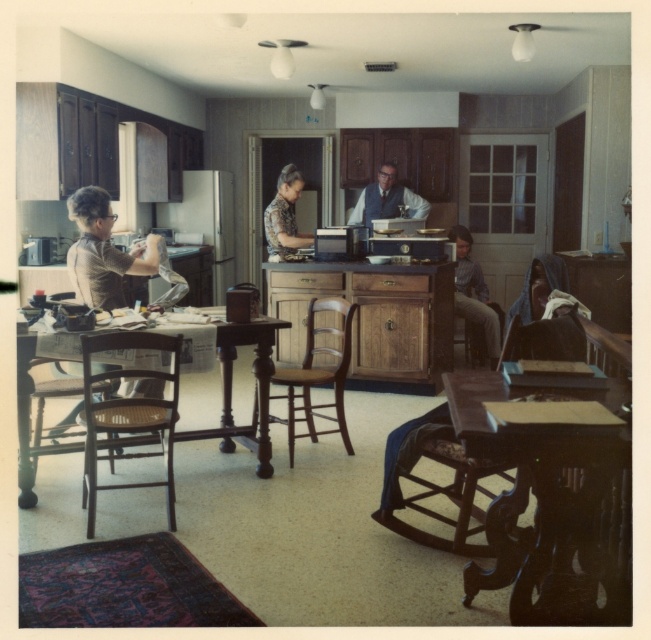
Question: Is woven wood chair at lower left further to camera compared to woven wood chair at lower right?

Choices:
 (A) no
 (B) yes

Answer: (A)

Question: Estimate the real-world distances between objects in this image. Which object is farther from the floral shirt at center?

Choices:
 (A) woven cane chair at left
 (B) brown wooden table at left
 (C) matte black vest at center

Answer: (A)

Question: Which is nearer to the dark wood table at lower right?

Choices:
 (A) woven wood chair at lower right
 (B) floral shirt at center
 (C) woven cane chair at left

Answer: (C)

Question: Does brown wooden table at left have a greater width compared to wooden chair at center?

Choices:
 (A) no
 (B) yes

Answer: (A)

Question: Considering the relative positions of woven cane chair at left and woven wood chair at lower left in the image provided, where is woven cane chair at left located with respect to woven wood chair at lower left?

Choices:
 (A) above
 (B) below

Answer: (B)

Question: Among these points, which one is farthest from the camera?

Choices:
 (A) (482, 362)
 (B) (283, 321)
 (C) (270, 202)
 (D) (339, 374)

Answer: (C)